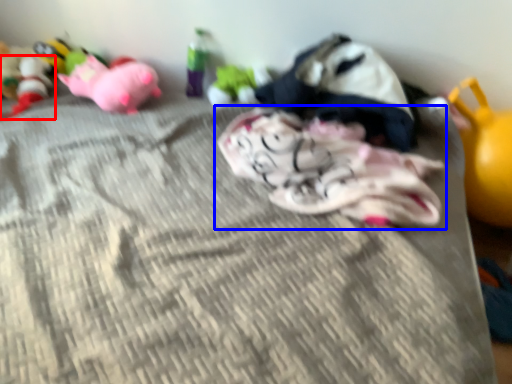
Question: Which point is further to the camera, toy (highlighted by a red box) or toy (highlighted by a blue box)?

Choices:
 (A) toy
 (B) toy

Answer: (A)